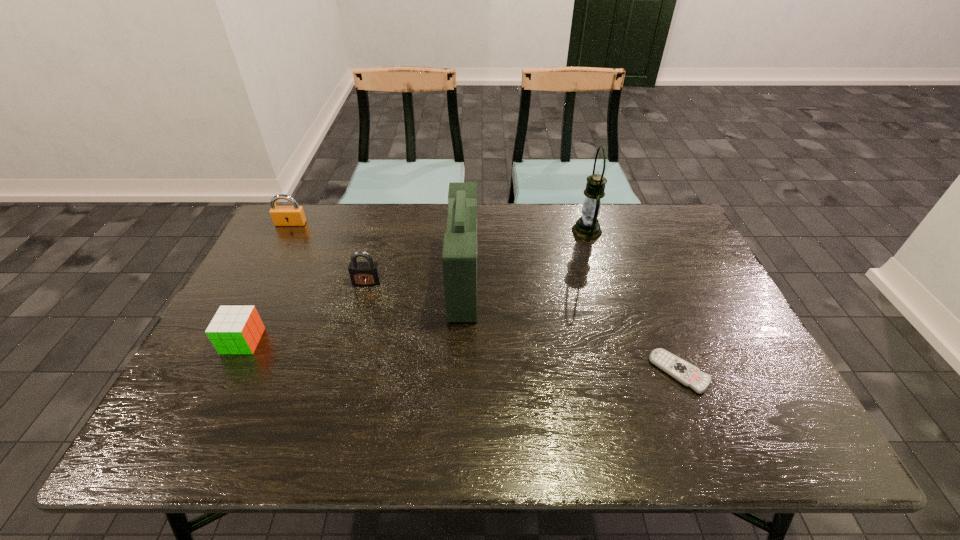
At what (x,y) coordinates should I click in order to perform the action: click on the second object from right to left. Please return your answer as a coordinate pair (x, y). The image size is (960, 540). Looking at the image, I should click on (587, 227).

Locate an element on the screen. This screenshot has height=540, width=960. the third object from right to left is located at coordinates (459, 258).

Locate an element on the screen. The image size is (960, 540). the first-aid kit is located at coordinates (459, 258).

Find the location of a particular element. the left padlock is located at coordinates (294, 215).

Where is `the right padlock`? the right padlock is located at coordinates (362, 273).

Identify the location of the nearer padlock. (362, 273).

Where is `the second shortest object`? Image resolution: width=960 pixels, height=540 pixels. the second shortest object is located at coordinates (234, 329).

Locate an element on the screen. The height and width of the screenshot is (540, 960). the shortest object is located at coordinates (687, 374).

Where is `the rightmost object`? the rightmost object is located at coordinates (687, 374).

Find the location of a particular element. vacant space located on the side where the lantern emits light is located at coordinates (515, 231).